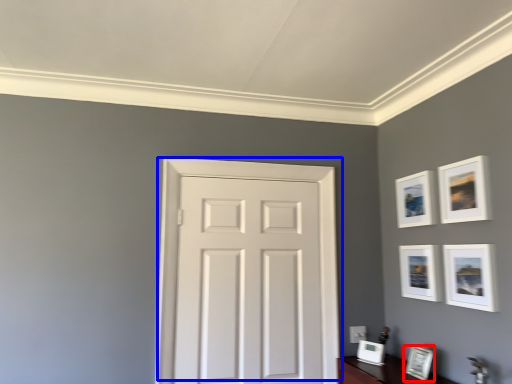
Question: Which object is closer to the camera taking this photo, picture frame (highlighted by a red box) or door (highlighted by a blue box)?

Choices:
 (A) picture frame
 (B) door

Answer: (A)